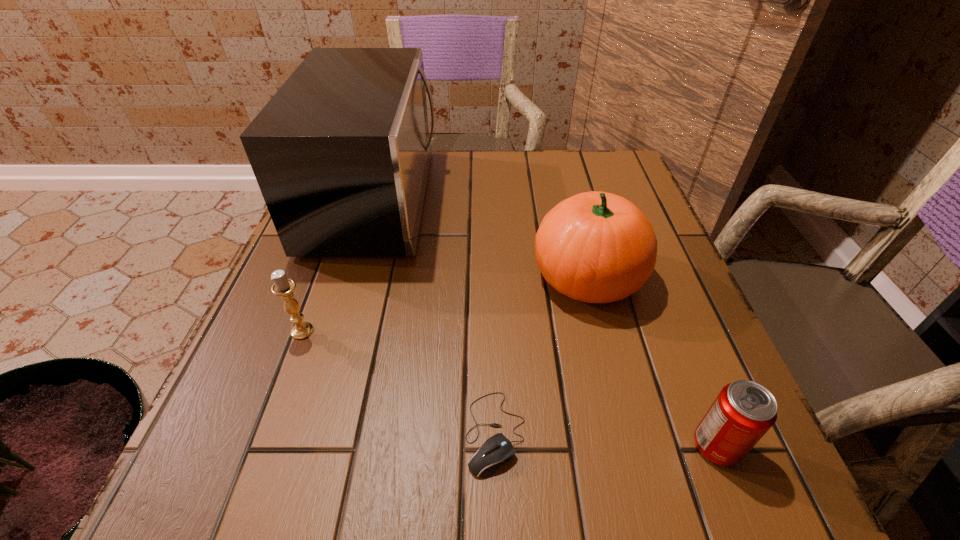
Identify the location of the tallest object. (341, 153).

Identify the location of pumpkin. (596, 247).

Image resolution: width=960 pixels, height=540 pixels. What are the coordinates of `the third farthest object` in the screenshot? It's located at (283, 286).

The height and width of the screenshot is (540, 960). I want to click on soda can, so click(x=743, y=411).

You are a GUI agent. You are given a task and a screenshot of the screen. Output one action in this format:
    pyautogui.click(x=<x>, y=<y>)
    Task: Click on the shortest object
    This screenshot has width=960, height=540.
    Given the screenshot: What is the action you would take?
    pyautogui.click(x=496, y=450)

The image size is (960, 540). I want to click on the third object from right to left, so click(496, 450).

I want to click on vacant space located with the door open on the tallest object, so click(471, 199).

At what (x,y) coordinates should I click in order to perform the action: click on free location located on the left of the pumpkin. Please return your answer as a coordinate pair (x, y). Image resolution: width=960 pixels, height=540 pixels. Looking at the image, I should click on (354, 276).

Where is `free space located 0.200m on the back of the third nearest object`? free space located 0.200m on the back of the third nearest object is located at coordinates (332, 249).

Where is `vacant space located on the left of the soda can`? vacant space located on the left of the soda can is located at coordinates (643, 446).